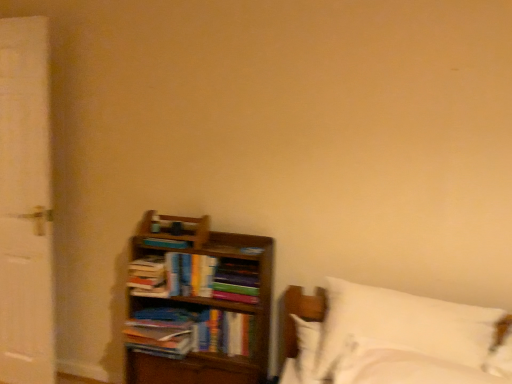
At what (x,y) coordinates should I click in order to perform the action: click on vacant space situated above hardcover book at center, the fourth book positioned from the top (from a real-world perspective). Please return your answer as a coordinate pair (x, y). The height and width of the screenshot is (384, 512). Looking at the image, I should click on (225, 308).